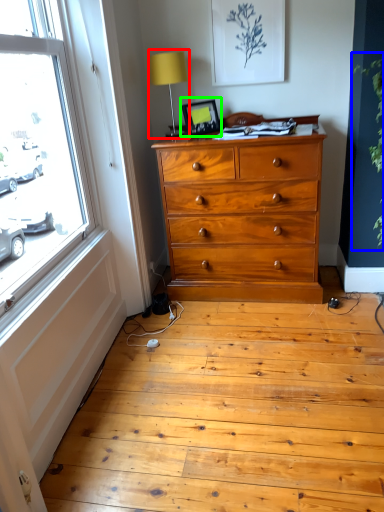
Question: Which object is positioned farthest from table lamp (highlighted by a red box)? Select from plant (highlighted by a blue box) and picture frame (highlighted by a green box).

Choices:
 (A) plant
 (B) picture frame

Answer: (A)